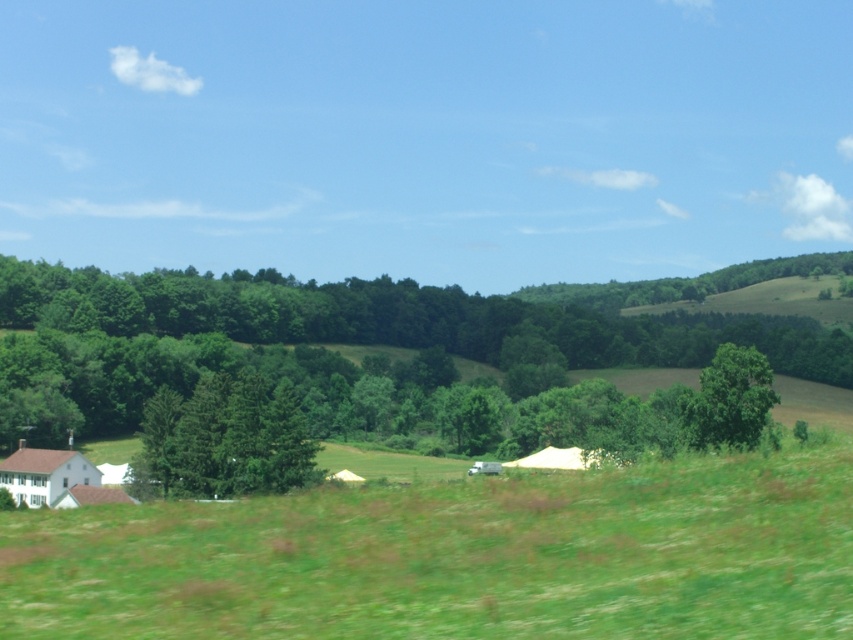
Question: Is the position of green grassy field at lower center more distant than that of green leafy tree at center-right?

Choices:
 (A) yes
 (B) no

Answer: (B)

Question: Can you confirm if green grassy field at lower center is bigger than green leafy tree at center-right?

Choices:
 (A) no
 (B) yes

Answer: (A)

Question: Which of these objects is positioned closest to the white fabric tent at center?

Choices:
 (A) green grassy field at lower center
 (B) green matte tree at center

Answer: (A)

Question: Does green matte tree at center have a smaller size compared to green leafy tree at center-right?

Choices:
 (A) yes
 (B) no

Answer: (B)

Question: Which object appears farthest from the camera in this image?

Choices:
 (A) green matte tree at center
 (B) white fabric tent at center
 (C) green leafy tree at center

Answer: (C)

Question: Which of the following is the closest to the observer?

Choices:
 (A) white fabric tent at center
 (B) green matte tree at center
 (C) green leafy tree at center
 (D) green leafy tree at center-right

Answer: (A)